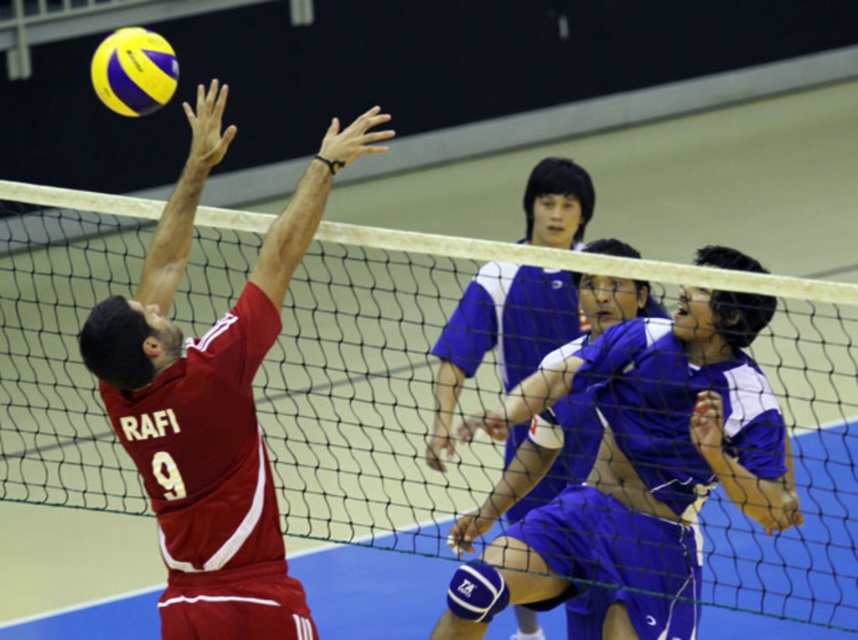
Which is in front, point (607, 268) or point (104, 312)?

Positioned in front is point (104, 312).

In the scene shown: Can you confirm if white mesh net at center is positioned to the left of matte red jersey at upper left?

Correct, you'll find white mesh net at center to the left of matte red jersey at upper left.

You are a GUI agent. You are given a task and a screenshot of the screen. Output one action in this format:
    pyautogui.click(x=<x>, y=<y>)
    Task: Click on the white mesh net at center
    
    Given the screenshot: What is the action you would take?
    pyautogui.click(x=500, y=444)

Does point (733, 346) come in front of point (113, 54)?

No, it is not.

Consider the image. Can you confirm if blue jersey at center is taller than yellow matte volleyball at upper left?

Yes.

Where is `blue jersey at center`? The image size is (858, 640). blue jersey at center is located at coordinates (641, 468).

Image resolution: width=858 pixels, height=640 pixels. Identify the location of blue jersey at center. (641, 468).

Can you confirm if matte red jersey at upper left is shorter than yellow matte volleyball at upper left?

No.

From the picture: Can you confirm if matte red jersey at upper left is smaller than yellow matte volleyball at upper left?

Actually, matte red jersey at upper left might be larger than yellow matte volleyball at upper left.

The image size is (858, 640). I want to click on matte red jersey at upper left, so click(x=212, y=400).